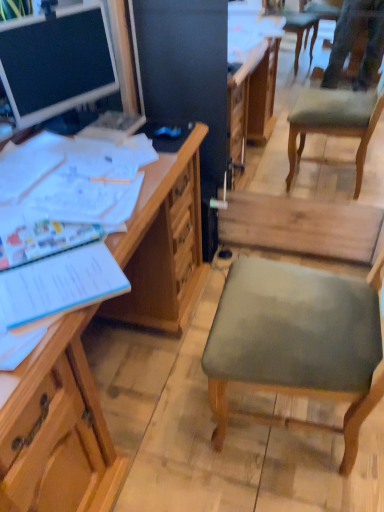
Question: Is wooden desk at left, which appears as the first desk when ordered from the bottom, situated inside matte wooden desk at upper left, which is counted as the second desk, starting from the bottom, or outside?

Choices:
 (A) inside
 (B) outside

Answer: (B)

Question: Considering their positions, is wooden desk at left, which appears as the first desk when ordered from the bottom, located in front of or behind matte wooden desk at upper left, the 1th desk in the top-to-bottom sequence?

Choices:
 (A) front
 (B) behind

Answer: (A)

Question: Which object is the farthest from the matte wooden desk at upper left, the 1th desk in the top-to-bottom sequence?

Choices:
 (A) wooden desk at left, the 2th desk from the top
 (B) blue paper notebook at left

Answer: (B)

Question: Which object is positioned closest to the matte wooden desk at upper left, the 1th desk in the top-to-bottom sequence?

Choices:
 (A) blue paper notebook at left
 (B) wooden desk at left, the 2th desk from the top

Answer: (B)